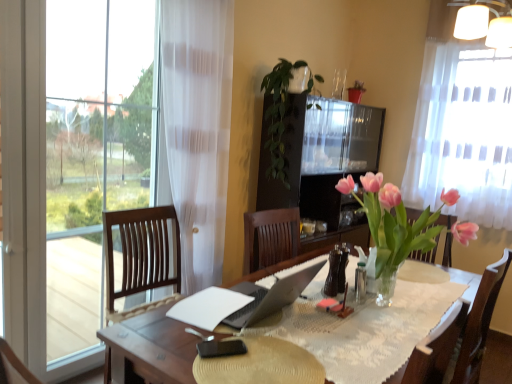
What do you see at coordinates (336, 271) in the screenshot? I see `brown leather bottle at center` at bounding box center [336, 271].

Locate an element on the screen. white matte lampshade at upper right is located at coordinates (484, 22).

The height and width of the screenshot is (384, 512). I want to click on green leafy plant at center, so click(x=281, y=114).

What do you see at coordinates (281, 114) in the screenshot?
I see `green leafy plant at center` at bounding box center [281, 114].

Where is `black matte phone at center`? This screenshot has height=384, width=512. black matte phone at center is located at coordinates (261, 364).

Is green leafy plant at center facing away from white paper at center?

No, green leafy plant at center is not facing the opposite direction of white paper at center.

Who is bigger, green leafy plant at center or white paper at center?

green leafy plant at center.

Looking at this image, which object is wider, green leafy plant at center or white paper at center?

green leafy plant at center is wider.

From the image's perspective, which is below, green leafy plant at center or white paper at center?

white paper at center.

Can you confirm if white paper at center is taller than green leafy plant at center?

No, white paper at center is not taller than green leafy plant at center.

Looking at their sizes, would you say white paper at center is wider or thinner than green leafy plant at center?

Clearly, white paper at center has less width compared to green leafy plant at center.

Is white paper at center next to green leafy plant at center?

They are not placed beside each other.

I want to click on flat in front of the brown leather bottle at center, so click(261, 364).

From the image's perspective, is brown leather bottle at center beneath black matte phone at center?

No.

Based on the photo, would you say brown leather bottle at center contains black matte phone at center?

Actually, black matte phone at center is outside brown leather bottle at center.

Which is farther, (343,270) or (315,359)?

Point (343,270)

Does white paper at center have a lesser height compared to white sheer curtain at upper right?

Yes, white paper at center is shorter than white sheer curtain at upper right.

Would you consider white paper at center to be distant from white sheer curtain at upper right?

Yes, white paper at center and white sheer curtain at upper right are located far from each other.

Who is bigger, white paper at center or white sheer curtain at upper right?

white sheer curtain at upper right.

Is white paper at center surrounding white sheer curtain at upper right?

Actually, white sheer curtain at upper right is outside white paper at center.

Is white matte lampshade at upper right spatially inside white paper at center, or outside of it?

white matte lampshade at upper right is not enclosed by white paper at center.

From the image's perspective, which one is positioned lower, white matte lampshade at upper right or white paper at center?

white paper at center is shown below in the image.

Locate an element on the screen. lamp to the right of white paper at center is located at coordinates (484, 22).

Is white matte lampshade at upper right touching white paper at center?

There is a gap between white matte lampshade at upper right and white paper at center.

Is green leafy plant at center looking in the opposite direction of white matte lampshade at upper right?

No, green leafy plant at center is not facing the opposite direction of white matte lampshade at upper right.

Is green leafy plant at center in front of white matte lampshade at upper right?

That is True.

Is point (286, 87) positioned in front of point (460, 34)?

No, (286, 87) is behind (460, 34).

Is green leafy plant at center at the left side of white matte lampshade at upper right?

Yes, green leafy plant at center is to the left of white matte lampshade at upper right.

Is green leafy plant at center shorter than white sheer curtain at upper right?

Correct, green leafy plant at center is not as tall as white sheer curtain at upper right.

Could you tell me if green leafy plant at center is facing white sheer curtain at upper right?

No, green leafy plant at center is not oriented towards white sheer curtain at upper right.

From the image's perspective, is green leafy plant at center positioned above or below white sheer curtain at upper right?

green leafy plant at center is below white sheer curtain at upper right.

Based on the photo, is green leafy plant at center bigger than white sheer curtain at upper right?

No, green leafy plant at center is not bigger than white sheer curtain at upper right.

Locate an element on the screen. The width and height of the screenshot is (512, 384). plant above the white paper at center (from a real-world perspective) is located at coordinates (281, 114).

I want to click on plant that is on the right side of white paper at center, so click(281, 114).

Estimate the real-world distances between objects in this image. Which object is further from white sheer curtain at upper right, black matte phone at center or green leafy plant at center?

Among the two, black matte phone at center is located further to white sheer curtain at upper right.

Based on their spatial positions, is black matte phone at center or green leafy plant at center closer to white matte lampshade at upper right?

green leafy plant at center is closer to white matte lampshade at upper right.

When comparing their distances from green leafy plant at center, does brown leather bottle at center or white sheer curtain at upper right seem closer?

brown leather bottle at center is positioned closer to the anchor green leafy plant at center.

Estimate the real-world distances between objects in this image. Which object is closer to white paper at center, white matte lampshade at upper right or black matte phone at center?

black matte phone at center is positioned closer to the anchor white paper at center.

When comparing their distances from white matte lampshade at upper right, does white paper at center or brown leather bottle at center seem further?

Among the two, white paper at center is located further to white matte lampshade at upper right.

Considering their positions, is green leafy plant at center positioned closer to white paper at center than white sheer curtain at upper right?

Among the two, green leafy plant at center is located nearer to white paper at center.

When comparing their distances from white paper at center, does white sheer curtain at upper right or white matte lampshade at upper right seem further?

The object further to white paper at center is white matte lampshade at upper right.

Estimate the real-world distances between objects in this image. Which object is closer to white sheer curtain at upper right, white matte lampshade at upper right or white paper at center?

white matte lampshade at upper right is closer to white sheer curtain at upper right.

At what (x,y) coordinates should I click in order to perform the action: click on bottle located between white paper at center and white sheer curtain at upper right in the left-right direction. Please return your answer as a coordinate pair (x, y). The image size is (512, 384). Looking at the image, I should click on (336, 271).

Locate an element on the screen. The image size is (512, 384). curtain situated between white paper at center and white matte lampshade at upper right from left to right is located at coordinates pyautogui.click(x=463, y=134).

Find the location of a particular element. The height and width of the screenshot is (384, 512). curtain located between green leafy plant at center and white matte lampshade at upper right in the left-right direction is located at coordinates (463, 134).

You are a GUI agent. You are given a task and a screenshot of the screen. Output one action in this format:
    pyautogui.click(x=<x>, y=<y>)
    Task: Click on the bottle located between black matte phone at center and green leafy plant at center in the depth direction
    The image size is (512, 384).
    Given the screenshot: What is the action you would take?
    pyautogui.click(x=336, y=271)